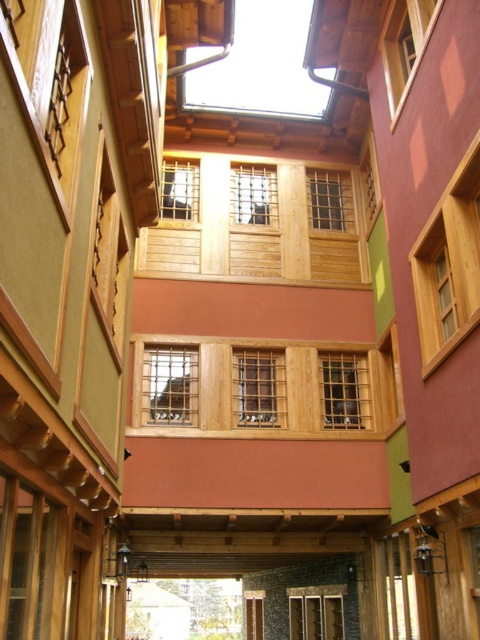
You are a painter who wants to set up an easel in the courtyard. You notice two balconies, the wooden balcony at center and the natural wood balcony at center. Which balcony has more space to accommodate your equipment?

The wooden balcony at center might be wider than natural wood balcony at center, so it likely has more space to accommodate your equipment.

You are standing in the courtyard and want to walk from the wooden balcony at center to the natural wood balcony at center. Which balcony should you step onto first?

You should step onto the wooden balcony at center first since it is in front of the natural wood balcony at center, making it accessible first.